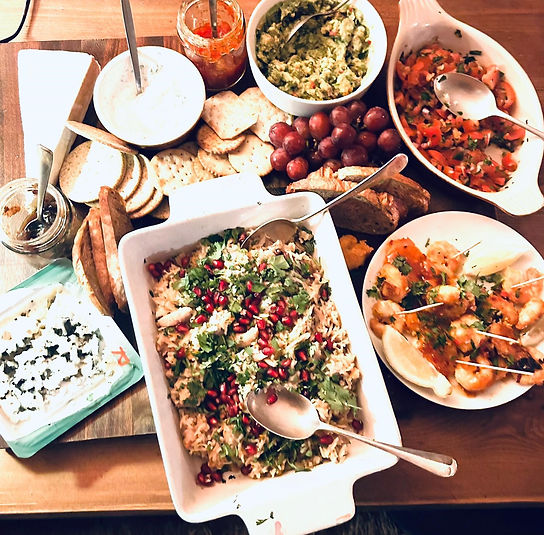
You are a GUI agent. You are given a task and a screenshot of the screen. Output one action in this format:
    pyautogui.click(x=<x>, y=<y>)
    Task: Click on the cassarole dishes
    Image resolution: width=544 pixels, height=535 pixels.
    Given the screenshot: What is the action you would take?
    219,209, 516,192, 301,102, 57,231